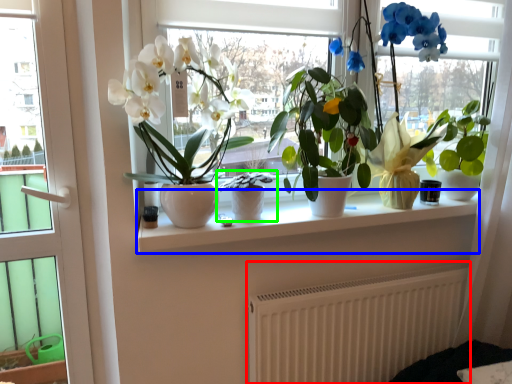
Question: Which object is positioned closest to radiator (highlighted by a red box)? Select from window sill (highlighted by a blue box) and houseplant (highlighted by a green box).

Choices:
 (A) window sill
 (B) houseplant

Answer: (A)